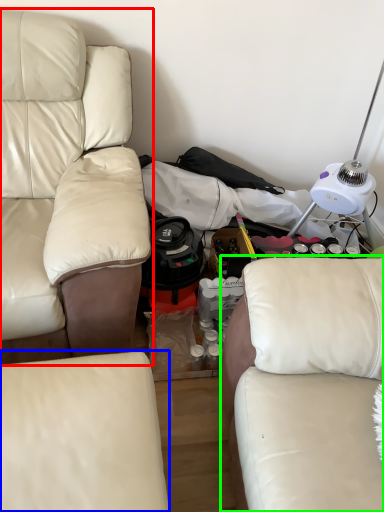
Question: Which is nearer to the studio couch (highlighted by a red box)? studio couch (highlighted by a blue box) or studio couch (highlighted by a green box).

Choices:
 (A) studio couch
 (B) studio couch

Answer: (A)